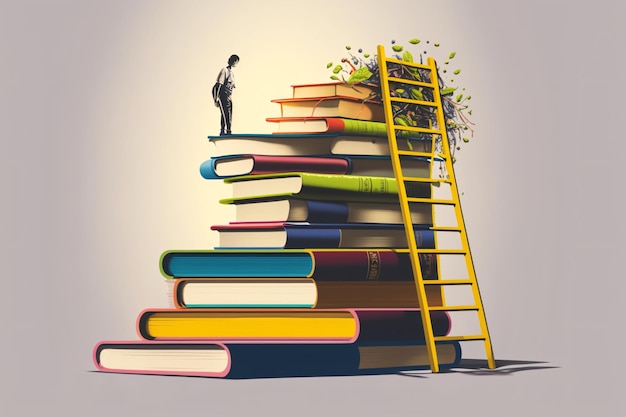
Locate an element on the screen. books below man is located at coordinates (239, 145), (362, 166), (317, 169), (335, 183), (371, 217), (369, 233), (357, 260), (345, 291), (371, 327), (357, 366).